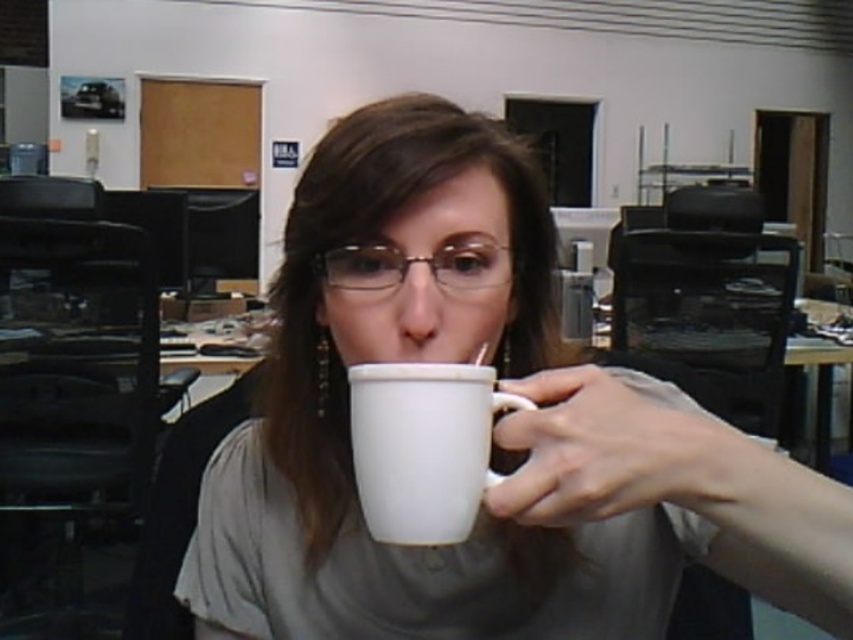
You are organizing a meeting in an office and need to place two mugs on a desk. There is a white glossy mug at center and a white ceramic mug at center. According to the image, which mug is positioned to the right of the other?

The white glossy mug at center is to the right of the white ceramic mug at center.

From the picture: You are organizing a meeting in an office and need to place two mugs on a narrow shelf. The shelf can only accommodate items up to 10 cm in width. You have the white glossy mug at center and the white ceramic mug at center. Based on their widths, can both mugs fit side by side on the shelf?

The white glossy mug at center might be wider than white ceramic mug at center. Since the shelf can only hold up to 10 cm, it is uncertain if both can fit without overlapping. Measure their combined width to confirm.

Please describe the exact position of the white glossy mug at center in the image using coordinates. The answer should be in the format of coordinates in parentheses.

The white glossy mug at center is located at coordinates point (494, 428).